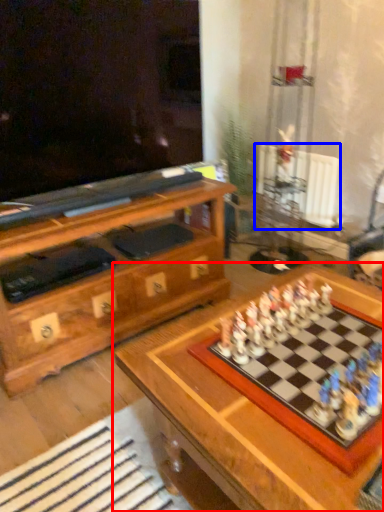
Question: Which object is further to the camera taking this photo, table (highlighted by a red box) or radiator (highlighted by a blue box)?

Choices:
 (A) table
 (B) radiator

Answer: (B)